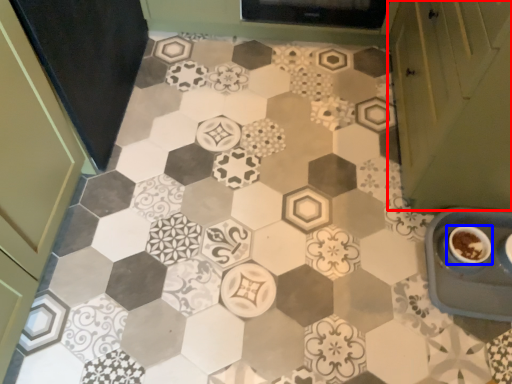
Question: Which object appears closest to the camera in this image, cabinetry (highlighted by a red box) or coffee cup (highlighted by a blue box)?

Choices:
 (A) cabinetry
 (B) coffee cup

Answer: (A)